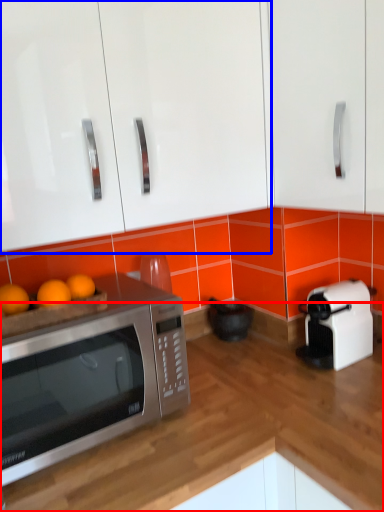
Question: Which point is further to the camera, counter top (highlighted by a red box) or cabinetry (highlighted by a blue box)?

Choices:
 (A) counter top
 (B) cabinetry

Answer: (B)